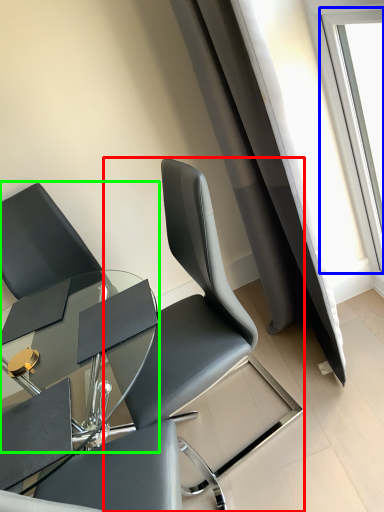
Question: Considering the real-world distances, which object is closest to chair (highlighted by a red box)? window (highlighted by a blue box) or chair (highlighted by a green box).

Choices:
 (A) window
 (B) chair

Answer: (B)